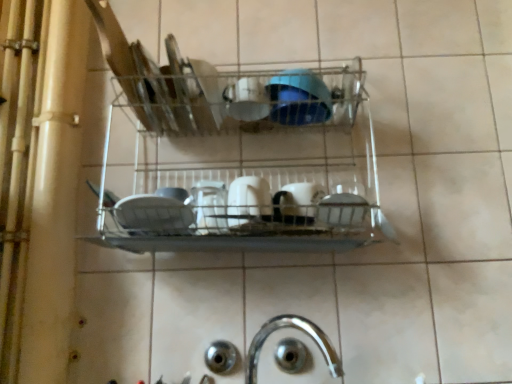
Question: Is metallic wire rack at center not within white glossy mug at center, the fourth tableware positioned from the top?

Choices:
 (A) no
 (B) yes

Answer: (B)

Question: From a real-world perspective, is metallic wire rack at center over white glossy mug at center, the 1th tableware positioned from the bottom?

Choices:
 (A) no
 (B) yes

Answer: (B)

Question: Would you say white glossy mug at center, the 1th tableware positioned from the bottom, is part of metallic wire rack at center's contents?

Choices:
 (A) yes
 (B) no

Answer: (A)

Question: Can you confirm if metallic wire rack at center is wider than white glossy mug at center, the 1th tableware positioned from the bottom?

Choices:
 (A) no
 (B) yes

Answer: (B)

Question: Does metallic wire rack at center lie in front of white glossy mug at center, the fourth tableware positioned from the top?

Choices:
 (A) no
 (B) yes

Answer: (B)

Question: Considering the positions of blue glossy bowl at center, the first tableware when ordered from top to bottom, and white glossy mug at center, arranged as the 2th tableware when ordered from the bottom, in the image, is blue glossy bowl at center, the first tableware when ordered from top to bottom, taller or shorter than white glossy mug at center, arranged as the 2th tableware when ordered from the bottom,?

Choices:
 (A) short
 (B) tall

Answer: (A)

Question: Is blue glossy bowl at center, which appears as the fourth tableware when ordered from the bottom, in front of or behind white glossy mug at center, placed as the third tableware when sorted from top to bottom, in the image?

Choices:
 (A) behind
 (B) front

Answer: (A)

Question: Is blue glossy bowl at center, the first tableware when ordered from top to bottom, spatially inside white glossy mug at center, placed as the third tableware when sorted from top to bottom, or outside of it?

Choices:
 (A) outside
 (B) inside

Answer: (A)

Question: Considering the positions of blue glossy bowl at center, the first tableware when ordered from top to bottom, and white glossy mug at center, arranged as the 2th tableware when ordered from the bottom, in the image, is blue glossy bowl at center, the first tableware when ordered from top to bottom, bigger or smaller than white glossy mug at center, arranged as the 2th tableware when ordered from the bottom,?

Choices:
 (A) big
 (B) small

Answer: (A)

Question: From the image's perspective, relative to silver metallic tap at lower center, is metallic wire rack at center above or below?

Choices:
 (A) below
 (B) above

Answer: (B)

Question: Is metallic wire rack at center wider or thinner than silver metallic tap at lower center?

Choices:
 (A) thin
 (B) wide

Answer: (B)

Question: Does point (186, 170) appear closer or farther from the camera than point (249, 352)?

Choices:
 (A) farther
 (B) closer

Answer: (A)

Question: Is metallic wire rack at center to the left or to the right of silver metallic tap at lower center in the image?

Choices:
 (A) left
 (B) right

Answer: (A)

Question: In terms of width, does white glossy mug at center, placed as the third tableware when sorted from top to bottom, look wider or thinner when compared to white glossy cup at upper center, which is the second tableware from top to bottom?

Choices:
 (A) thin
 (B) wide

Answer: (B)

Question: From a real-world perspective, is white glossy mug at center, arranged as the 2th tableware when ordered from the bottom, above or below white glossy cup at upper center, acting as the third tableware starting from the bottom?

Choices:
 (A) above
 (B) below

Answer: (B)